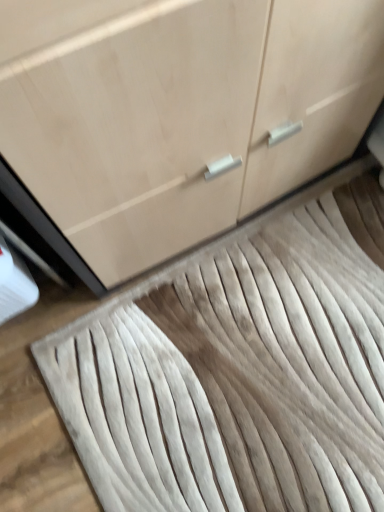
Question: Considering the relative positions of matte wood cabinet at center and white textured rug at center in the image provided, is matte wood cabinet at center to the left or to the right of white textured rug at center?

Choices:
 (A) left
 (B) right

Answer: (A)

Question: From a real-world perspective, is matte wood cabinet at center positioned above or below white textured rug at center?

Choices:
 (A) below
 (B) above

Answer: (B)

Question: From the image's perspective, is matte wood cabinet at center above or below white textured rug at center?

Choices:
 (A) below
 (B) above

Answer: (B)

Question: From a real-world perspective, is white textured rug at center positioned above or below matte wood cabinet at center?

Choices:
 (A) above
 (B) below

Answer: (B)

Question: Relative to matte wood cabinet at center, is white textured rug at center in front or behind?

Choices:
 (A) front
 (B) behind

Answer: (B)

Question: Would you say white textured rug at center is to the left or to the right of matte wood cabinet at center in the picture?

Choices:
 (A) right
 (B) left

Answer: (A)

Question: In terms of height, does white textured rug at center look taller or shorter compared to matte wood cabinet at center?

Choices:
 (A) tall
 (B) short

Answer: (B)